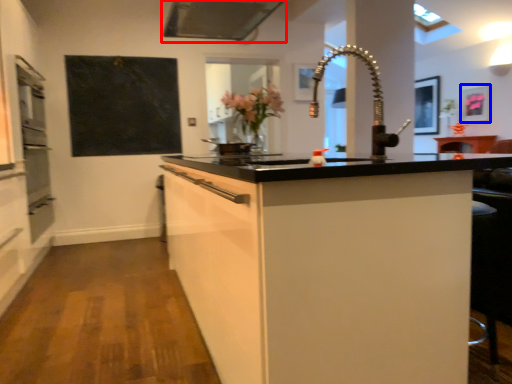
Question: Which object is further to the camera taking this photo, exhaust hood (highlighted by a red box) or picture frame (highlighted by a blue box)?

Choices:
 (A) exhaust hood
 (B) picture frame

Answer: (B)